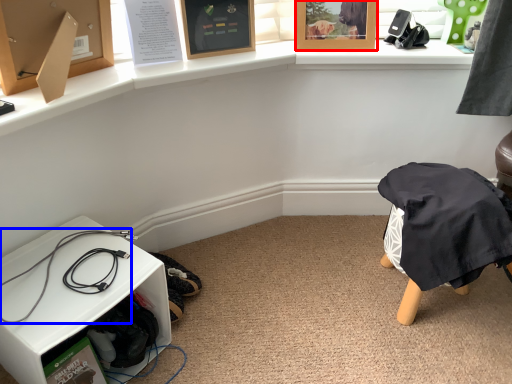
Question: Which object is further to the camera taking this photo, picture frame (highlighted by a red box) or wire (highlighted by a blue box)?

Choices:
 (A) picture frame
 (B) wire

Answer: (A)